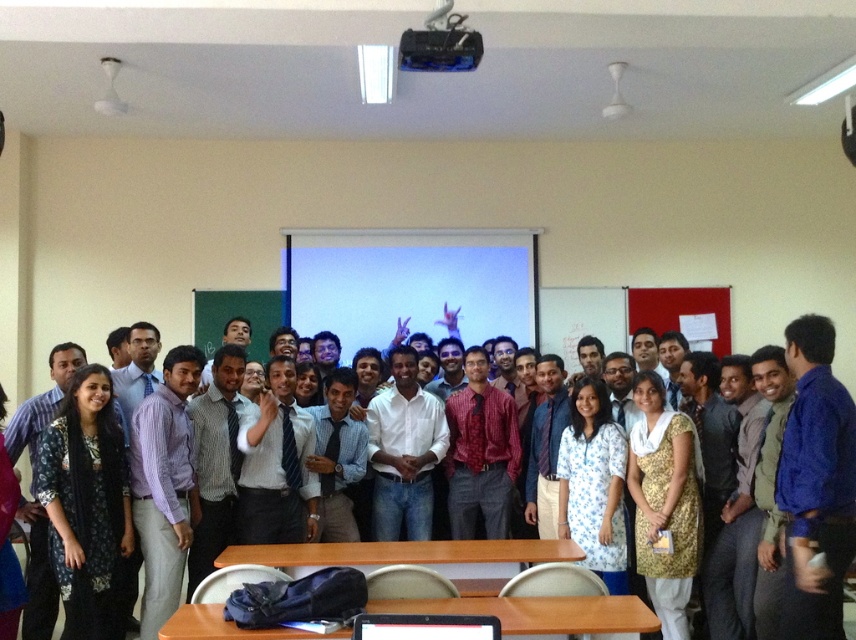
Question: Among these objects, which one is farthest from the camera?

Choices:
 (A) black glossy laptop at center
 (B) black fabric dress at left
 (C) wooden table at center

Answer: (B)

Question: Is wooden table at center behind brown wooden table at center?

Choices:
 (A) yes
 (B) no

Answer: (B)

Question: Which point appears closest to the camera in this image?

Choices:
 (A) coord(227,637)
 (B) coord(518,557)

Answer: (A)

Question: Which is nearer to the wooden table at center?

Choices:
 (A) black glossy laptop at center
 (B) brown wooden table at center
 (C) black fabric dress at left

Answer: (B)

Question: Observing the image, what is the correct spatial positioning of black fabric dress at left in reference to brown wooden table at center?

Choices:
 (A) right
 (B) left

Answer: (B)

Question: Is brown wooden table at center wider than black glossy laptop at center?

Choices:
 (A) yes
 (B) no

Answer: (A)